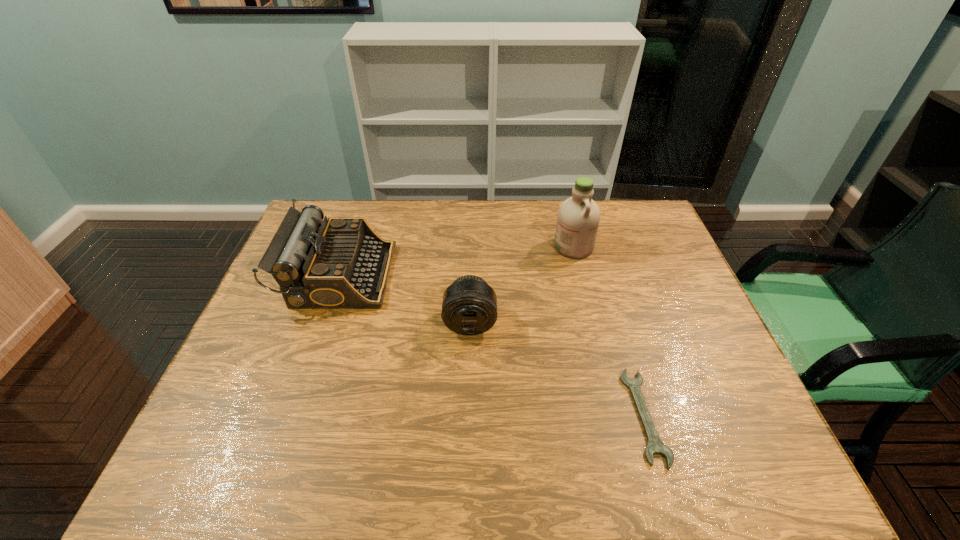
This screenshot has width=960, height=540. In order to click on vacant region that satisfies the following two spatial constraints: 1. on the front-facing side of the second object from left to right; 2. on the right side of the wrench in this screenshot , I will do `click(468, 416)`.

Identify the location of free space that satisfies the following two spatial constraints: 1. on the front label of the tallest object; 2. on the right side of the nearest object. (615, 416).

Identify the location of free space that satisfies the following two spatial constraints: 1. on the keyboard of the nearest object; 2. on the right side of the second tallest object. (291, 416).

Where is `vacant space that satisfies the following two spatial constraints: 1. on the front label of the tallest object; 2. on the front-facing side of the telephoto lens`? Image resolution: width=960 pixels, height=540 pixels. vacant space that satisfies the following two spatial constraints: 1. on the front label of the tallest object; 2. on the front-facing side of the telephoto lens is located at coordinates (592, 323).

The image size is (960, 540). What are the coordinates of `free space in the image that satisfies the following two spatial constraints: 1. on the front label of the cleansing agent; 2. on the front-facing side of the third object from right to left` in the screenshot? It's located at (592, 323).